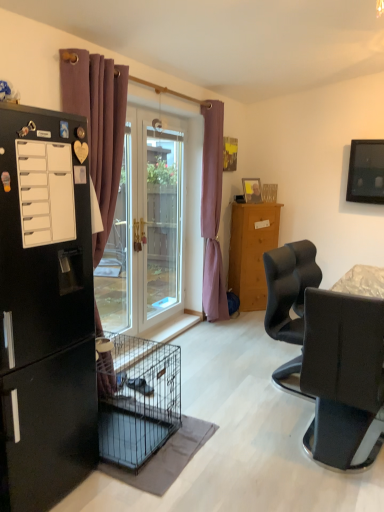
Question: Do you think wooden picture frame at upper center is within matte black chair at right, or outside of it?

Choices:
 (A) outside
 (B) inside

Answer: (A)

Question: In terms of height, does wooden picture frame at upper center look taller or shorter compared to matte black chair at right?

Choices:
 (A) tall
 (B) short

Answer: (B)

Question: Considering the real-world distances, which object is farthest from the transparent glass screen door at center?

Choices:
 (A) matte black refrigerator at center
 (B) matte black television at upper right
 (C) purple fabric curtain at left, arranged as the first curtain when viewed from the front
 (D) purple fabric curtain at center, which appears as the second curtain when viewed from the left
 (E) black matte refrigerator at left

Answer: (B)

Question: Which of these objects is positioned closest to the black matte refrigerator at left?

Choices:
 (A) matte black chair at right
 (B) purple fabric curtain at left, the 1th curtain positioned from the left
 (C) purple fabric curtain at center, which is the first curtain from back to front
 (D) wooden picture frame at upper center
 (E) matte black refrigerator at center

Answer: (B)